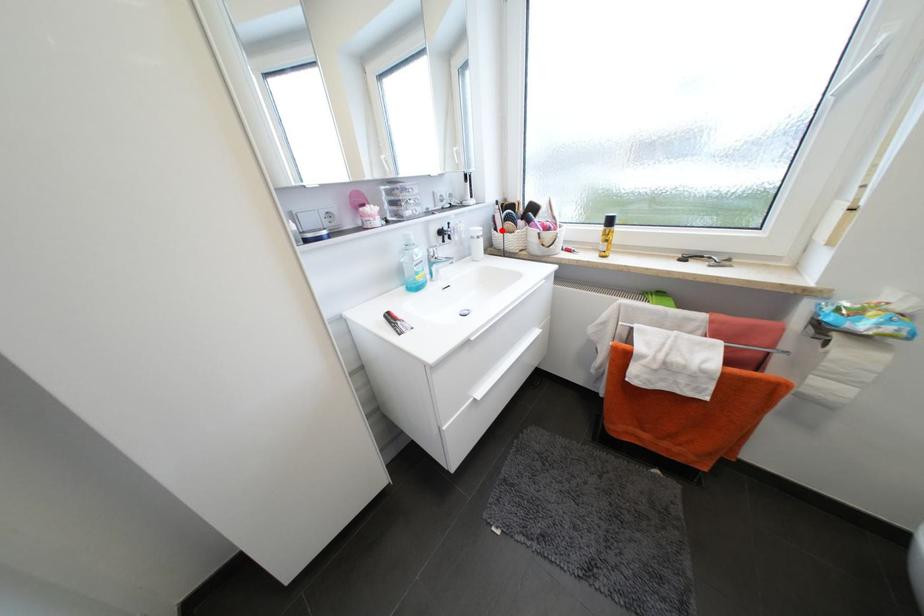
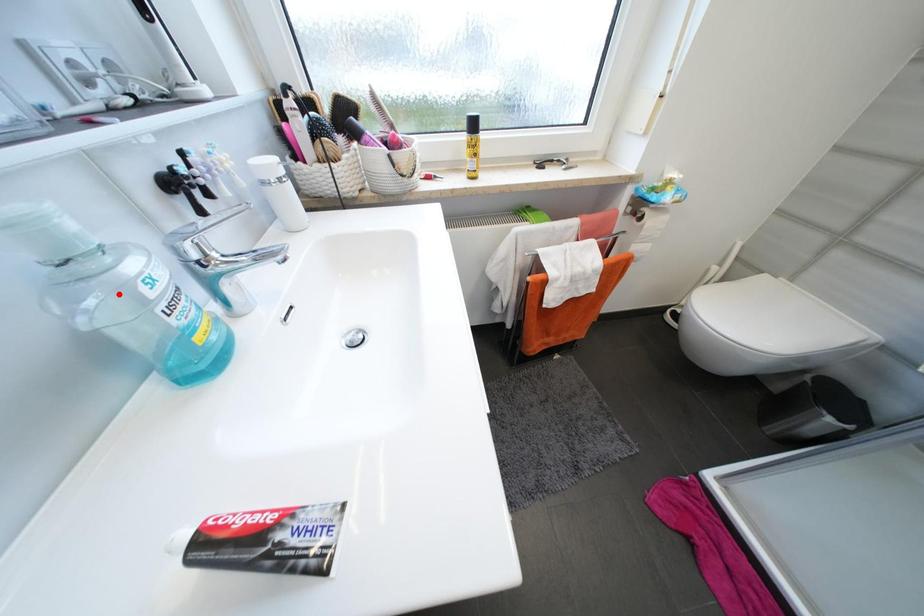
I am providing you with two images of the same scene from different viewpoints. A red point is marked on the first image and another point is marked on the second image. Does the point marked in image1 correspond to the same location as the one in image2?

No